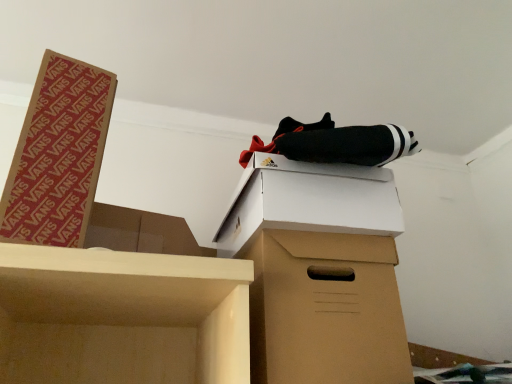
What do you see at coordinates (319, 271) in the screenshot?
I see `brown cardboard box at center` at bounding box center [319, 271].

You are a GUI agent. You are given a task and a screenshot of the screen. Output one action in this format:
    pyautogui.click(x=<x>, y=<y>)
    Task: Click on the white cardboard box at upper center, which appears as the first box when viewed from the right
    This screenshot has width=512, height=384.
    Given the screenshot: What is the action you would take?
    pyautogui.click(x=309, y=201)

Which object is positioned more to the right, brown cardboard box at left, which ranks as the second box in right-to-left order, or white cardboard box at upper center, which appears as the first box when viewed from the right?

From the viewer's perspective, white cardboard box at upper center, which appears as the first box when viewed from the right, appears more on the right side.

Is brown cardboard box at left, the first box from the left, not inside white cardboard box at upper center, which appears as the first box when viewed from the right?

Yes, brown cardboard box at left, the first box from the left, is located beyond the bounds of white cardboard box at upper center, which appears as the first box when viewed from the right.

Is brown cardboard box at left, which ranks as the second box in right-to-left order, far from white cardboard box at upper center, the second box viewed from the left?

No, there isn't a large distance between brown cardboard box at left, which ranks as the second box in right-to-left order, and white cardboard box at upper center, the second box viewed from the left.

This screenshot has height=384, width=512. In order to click on box in front of the white cardboard box at upper center, the second box viewed from the left in this screenshot , I will do `click(58, 154)`.

Looking at the image, does brown cardboard box at left, the first box from the left, seem bigger or smaller compared to brown cardboard box at center?

Considering their sizes, brown cardboard box at left, the first box from the left, takes up less space than brown cardboard box at center.

Is brown cardboard box at left, the first box from the left, shorter than brown cardboard box at center?

In fact, brown cardboard box at left, the first box from the left, may be taller than brown cardboard box at center.

Is brown cardboard box at left, the first box from the left, far away from brown cardboard box at center?

No, brown cardboard box at left, the first box from the left, is in close proximity to brown cardboard box at center.

From a real-world perspective, who is located higher, brown cardboard box at left, the first box from the left, or brown cardboard box at center?

brown cardboard box at left, the first box from the left.

Can we say white cardboard box at upper center, which appears as the first box when viewed from the right, lies outside brown cardboard box at left, which ranks as the second box in right-to-left order?

Yes, white cardboard box at upper center, which appears as the first box when viewed from the right, is not within brown cardboard box at left, which ranks as the second box in right-to-left order.

From a real-world perspective, which object rests below the other?

white cardboard box at upper center, the second box viewed from the left.

Is white cardboard box at upper center, the second box viewed from the left, turned away from brown cardboard box at left, which ranks as the second box in right-to-left order?

white cardboard box at upper center, the second box viewed from the left, is not turned away from brown cardboard box at left, which ranks as the second box in right-to-left order.

In terms of height, does brown cardboard box at center look taller or shorter compared to white cardboard box at upper center, the second box viewed from the left?

Clearly, brown cardboard box at center is taller compared to white cardboard box at upper center, the second box viewed from the left.

What's the angular difference between brown cardboard box at center and white cardboard box at upper center, which appears as the first box when viewed from the right,'s facing directions?

They differ by 2.44 degrees in their facing directions.

From a real-world perspective, who is located higher, brown cardboard box at center or white cardboard box at upper center, the second box viewed from the left?

white cardboard box at upper center, the second box viewed from the left, from a real-world perspective.

Is brown cardboard box at center positioned far away from white cardboard box at upper center, the second box viewed from the left?

No.

Can you confirm if white cardboard box at upper center, the second box viewed from the left, is wider than brown cardboard box at center?

Yes.

Is brown cardboard box at center at the back of white cardboard box at upper center, which appears as the first box when viewed from the right?

That's not correct — white cardboard box at upper center, which appears as the first box when viewed from the right, is not looking away from brown cardboard box at center.

Does white cardboard box at upper center, which appears as the first box when viewed from the right, have a smaller size compared to brown cardboard box at center?

Indeed, white cardboard box at upper center, which appears as the first box when viewed from the right, has a smaller size compared to brown cardboard box at center.

Can you confirm if white cardboard box at upper center, the second box viewed from the left, is taller than brown cardboard box at center?

In fact, white cardboard box at upper center, the second box viewed from the left, may be shorter than brown cardboard box at center.

From the image's perspective, is brown cardboard box at center on top of brown cardboard box at left, which ranks as the second box in right-to-left order?

Incorrect, from the image's perspective, brown cardboard box at center is lower than brown cardboard box at left, which ranks as the second box in right-to-left order.

Is brown cardboard box at center positioned behind brown cardboard box at left, which ranks as the second box in right-to-left order?

Yes, it is.

Would you consider brown cardboard box at center to be distant from brown cardboard box at left, the first box from the left?

No, brown cardboard box at center is not far away from brown cardboard box at left, the first box from the left.

Locate an element on the screen. box below the brown cardboard box at left, the first box from the left (from a real-world perspective) is located at coordinates (309, 201).

Where is `the 2nd box to the left of the brown cardboard box at center, starting your count from the anchor`? The image size is (512, 384). the 2nd box to the left of the brown cardboard box at center, starting your count from the anchor is located at coordinates click(x=58, y=154).

Estimate the real-world distances between objects in this image. Which object is further from brown cardboard box at left, which ranks as the second box in right-to-left order, white cardboard box at upper center, which appears as the first box when viewed from the right, or brown cardboard box at center?

brown cardboard box at center is positioned further to the anchor brown cardboard box at left, which ranks as the second box in right-to-left order.

Based on the photo, from the image, which object appears to be farther from brown cardboard box at center, brown cardboard box at left, the first box from the left, or white cardboard box at upper center, the second box viewed from the left?

Among the two, brown cardboard box at left, the first box from the left, is located further to brown cardboard box at center.

Consider the image. Looking at the image, which one is located further to brown cardboard box at left, which ranks as the second box in right-to-left order, brown cardboard box at center or white cardboard box at upper center, which appears as the first box when viewed from the right?

→ Among the two, brown cardboard box at center is located further to brown cardboard box at left, which ranks as the second box in right-to-left order.

When comparing their distances from brown cardboard box at center, does white cardboard box at upper center, the second box viewed from the left, or brown cardboard box at left, which ranks as the second box in right-to-left order, seem closer?

white cardboard box at upper center, the second box viewed from the left, is positioned closer to the anchor brown cardboard box at center.

Which object lies further to the anchor point white cardboard box at upper center, which appears as the first box when viewed from the right, brown cardboard box at center or brown cardboard box at left, the first box from the left?

brown cardboard box at left, the first box from the left, is further to white cardboard box at upper center, which appears as the first box when viewed from the right.

Considering their positions, is brown cardboard box at left, which ranks as the second box in right-to-left order, positioned closer to white cardboard box at upper center, the second box viewed from the left, than brown cardboard box at center?

Based on the image, brown cardboard box at center appears to be nearer to white cardboard box at upper center, the second box viewed from the left.

The height and width of the screenshot is (384, 512). I want to click on box between brown cardboard box at left, which ranks as the second box in right-to-left order, and brown cardboard box at center, in the horizontal direction, so click(309, 201).